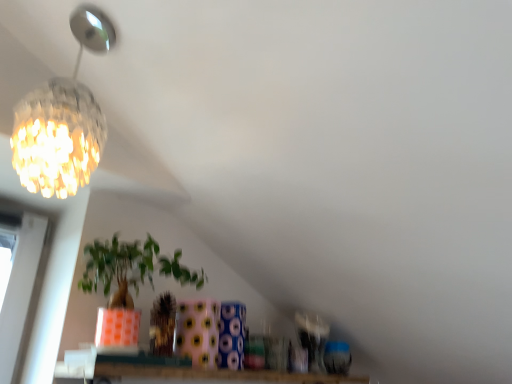
Image resolution: width=512 pixels, height=384 pixels. What are the coordinates of `transparent glass window at lower center` in the screenshot? It's located at click(x=191, y=373).

Find the location of a particular element. This screenshot has height=384, width=512. crystalline glass chandelier at upper left is located at coordinates (63, 120).

Measure the distance between point (129, 267) and camera.

Point (129, 267) and camera are 1.28 meters apart.

Locate an element on the screen. The width and height of the screenshot is (512, 384). transparent glass window at lower center is located at coordinates tap(191, 373).

In the scene shown: From a real-world perspective, between matte orange pot at center and transparent glass window at lower center, who is vertically higher?

matte orange pot at center, from a real-world perspective.

Can you tell me how much matte orange pot at center and transparent glass window at lower center differ in facing direction?

0.237 degrees.

From the image's perspective, is matte orange pot at center above transparent glass window at lower center?

Yes, from the image's perspective, matte orange pot at center is above transparent glass window at lower center.

Based on the photo, considering the relative positions of matte orange pot at center and transparent glass window at lower center in the image provided, is matte orange pot at center to the left of transparent glass window at lower center from the viewer's perspective?

Correct, you'll find matte orange pot at center to the left of transparent glass window at lower center.

Which is in front, crystalline glass chandelier at upper left or transparent glass window at lower center?

crystalline glass chandelier at upper left.

Which of these two, crystalline glass chandelier at upper left or transparent glass window at lower center, is bigger?

With larger size is crystalline glass chandelier at upper left.

Which object is positioned more to the left, crystalline glass chandelier at upper left or transparent glass window at lower center?

crystalline glass chandelier at upper left.

Is point (187, 373) positioned after point (95, 255)?

No.

Who is bigger, transparent glass window at lower center or matte orange pot at center?

matte orange pot at center is bigger.

Can matte orange pot at center be found inside transparent glass window at lower center?

No.

Based on the photo, from a real-world perspective, is transparent glass window at lower center on top of matte orange pot at center?

Actually, transparent glass window at lower center is physically below matte orange pot at center in the real world.

From their relative heights in the image, would you say crystalline glass chandelier at upper left is taller or shorter than matte orange pot at center?

Considering their sizes, crystalline glass chandelier at upper left has more height than matte orange pot at center.

From the image's perspective, is crystalline glass chandelier at upper left beneath matte orange pot at center?

Actually, crystalline glass chandelier at upper left appears above matte orange pot at center in the image.

Find the location of `lamp in front of the matte orange pot at center`. lamp in front of the matte orange pot at center is located at coordinates (63, 120).

Which of these two, matte orange pot at center or crystalline glass chandelier at upper left, stands shorter?

matte orange pot at center is shorter.

Is point (136, 263) closer or farther from the camera than point (86, 7)?

Point (136, 263) is farther from the camera than point (86, 7).

Is matte orange pot at center facing away from crystalline glass chandelier at upper left?

No, matte orange pot at center is not facing the opposite direction of crystalline glass chandelier at upper left.

Does matte orange pot at center have a larger size compared to crystalline glass chandelier at upper left?

Yes.

Does transparent glass window at lower center have a lesser width compared to crystalline glass chandelier at upper left?

In fact, transparent glass window at lower center might be wider than crystalline glass chandelier at upper left.

From the picture: In the image, is transparent glass window at lower center on the left side or the right side of crystalline glass chandelier at upper left?

In the image, transparent glass window at lower center appears on the right side of crystalline glass chandelier at upper left.

Are transparent glass window at lower center and crystalline glass chandelier at upper left beside each other?

There is a gap between transparent glass window at lower center and crystalline glass chandelier at upper left.

Is transparent glass window at lower center inside the boundaries of crystalline glass chandelier at upper left, or outside?

transparent glass window at lower center is spatially situated outside crystalline glass chandelier at upper left.

The image size is (512, 384). I want to click on window to the right of matte orange pot at center, so click(x=191, y=373).

Identify the location of lamp located above the transparent glass window at lower center (from a real-world perspective). The height and width of the screenshot is (384, 512). (63, 120).

When comparing their distances from transparent glass window at lower center, does matte orange pot at center or crystalline glass chandelier at upper left seem further?

Based on the image, crystalline glass chandelier at upper left appears to be further to transparent glass window at lower center.

Considering their positions, is crystalline glass chandelier at upper left positioned closer to matte orange pot at center than transparent glass window at lower center?

transparent glass window at lower center is closer to matte orange pot at center.

Based on their spatial positions, is crystalline glass chandelier at upper left or matte orange pot at center further from transparent glass window at lower center?

crystalline glass chandelier at upper left.

When comparing their distances from crystalline glass chandelier at upper left, does matte orange pot at center or transparent glass window at lower center seem further?

The object further to crystalline glass chandelier at upper left is transparent glass window at lower center.

Based on their spatial positions, is transparent glass window at lower center or matte orange pot at center closer to crystalline glass chandelier at upper left?

matte orange pot at center.

From the image, which object appears to be farther from matte orange pot at center, transparent glass window at lower center or crystalline glass chandelier at upper left?

The object further to matte orange pot at center is crystalline glass chandelier at upper left.

Identify the location of houseplant between crystalline glass chandelier at upper left and transparent glass window at lower center in the up-down direction. The image size is (512, 384). (131, 269).